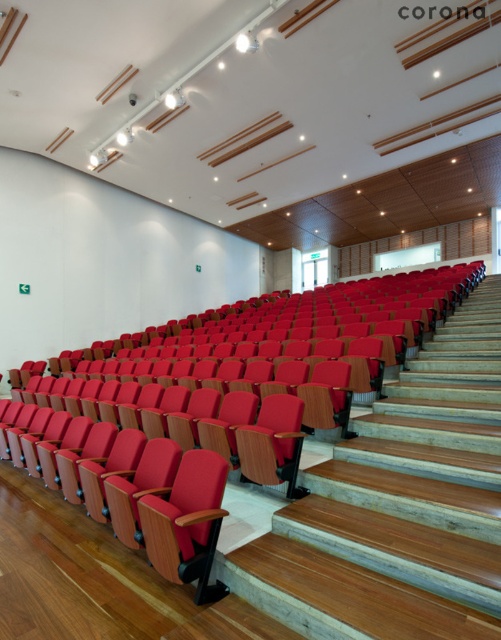
Question: Does wooden at center appear on the right side of matte red seat at center?

Choices:
 (A) yes
 (B) no

Answer: (A)

Question: Is wooden at center to the right of matte red seat at center from the viewer's perspective?

Choices:
 (A) no
 (B) yes

Answer: (B)

Question: Which of the following is the closest to the observer?

Choices:
 (A) matte red seat at center
 (B) wooden at center

Answer: (B)

Question: From the image, what is the correct spatial relationship of wooden at center in relation to matte red seat at center?

Choices:
 (A) left
 (B) right

Answer: (B)